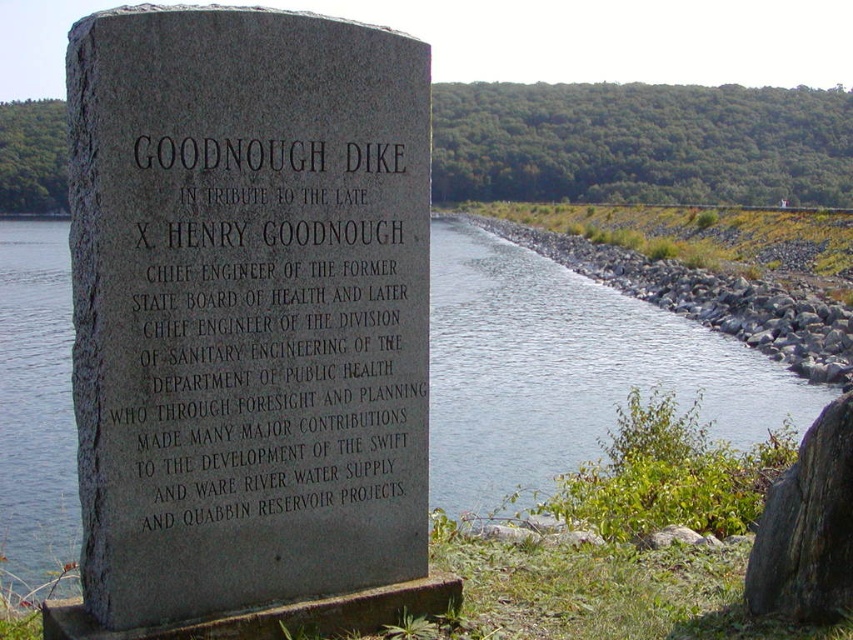
Is gray rock at center below gray rough rock at right?

Actually, gray rock at center is above gray rough rock at right.

Is point (752, 284) less distant than point (782, 518)?

No, (752, 284) is behind (782, 518).

Does point (834, 381) come behind point (778, 513)?

That is True.

Find the location of `gray rock at center`. gray rock at center is located at coordinates (711, 300).

Can you confirm if gray stone monument at center is positioned above gray rock at center?

Incorrect, gray stone monument at center is not positioned above gray rock at center.

Is gray stone monument at center behind gray rock at center?

No, gray stone monument at center is in front of gray rock at center.

Who is more distant from viewer, (194, 544) or (788, 358)?

The point (788, 358) is more distant.

Image resolution: width=853 pixels, height=640 pixels. Find the location of `gray stone monument at center`. gray stone monument at center is located at coordinates (247, 308).

In the scene shown: Who is taller, clear water at center or gray rock at center?

With more height is clear water at center.

Who is more forward, (810, 396) or (811, 353)?

Point (810, 396) is in front.

Is point (531, 497) positioned before point (799, 317)?

That is True.

Identify the location of clear water at center. pyautogui.click(x=566, y=371).